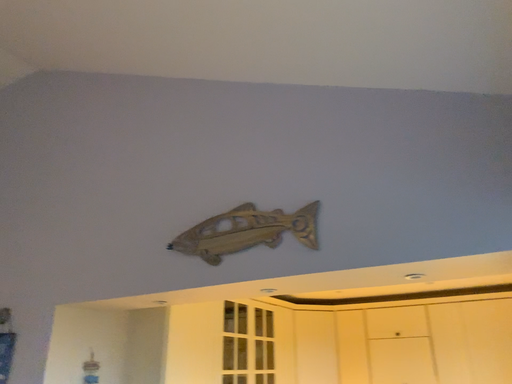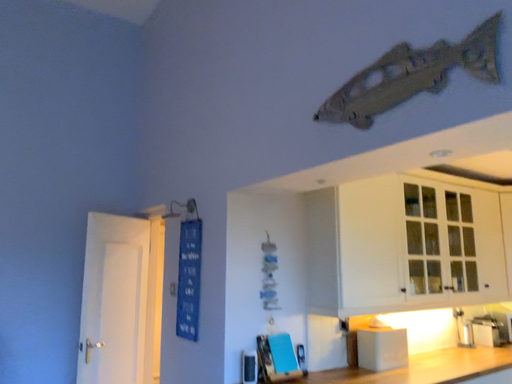
Question: Which way did the camera rotate in the video?

Choices:
 (A) rotated left
 (B) rotated right

Answer: (A)